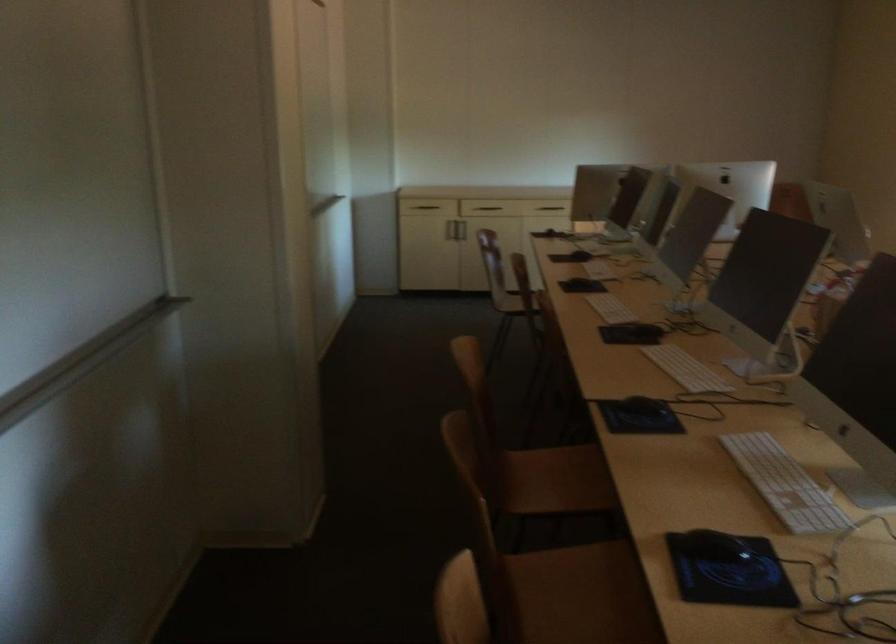
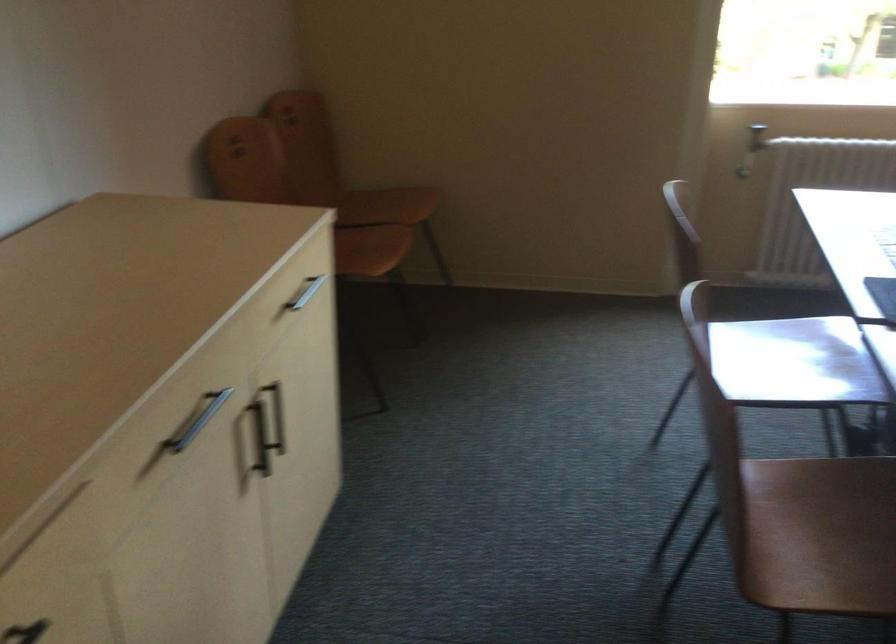
Question: I am providing you with two images of the same scene from different viewpoints. Which of the following objects are not visible in image2?

Choices:
 (A) silver cabinet handle
 (B) black glasses
 (C) radiator valve knob
 (D) dark drawer handle

Answer: (D)